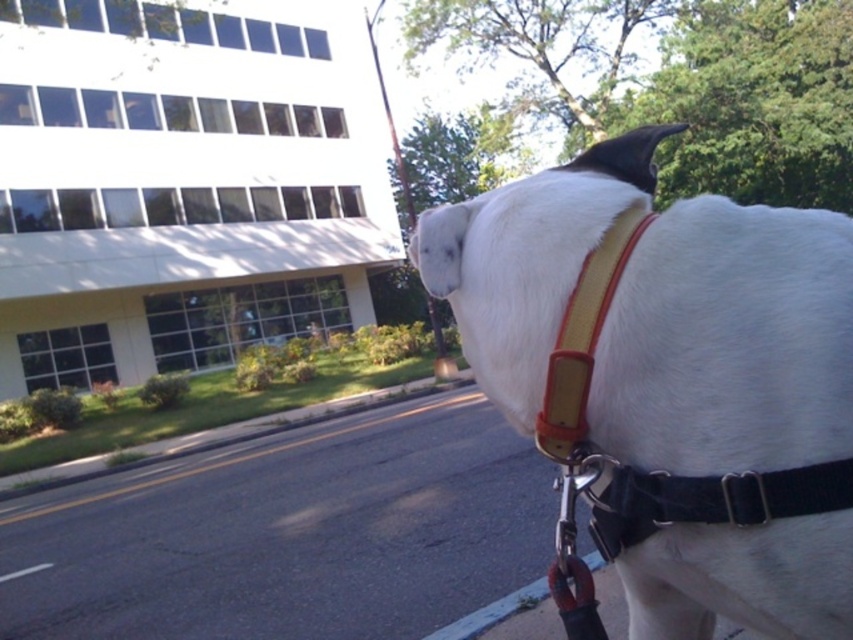
Does white matte dog at center have a lesser height compared to black leather strap at right?

No.

Can you confirm if white matte dog at center is thinner than black leather strap at right?

In fact, white matte dog at center might be wider than black leather strap at right.

Who is more distant from viewer, (466, 232) or (648, 509)?

Positioned behind is point (466, 232).

This screenshot has width=853, height=640. In order to click on white matte dog at center in this screenshot , I will do `click(671, 380)`.

Is white matte dog at center shorter than yellow leather strap at upper center?

In fact, white matte dog at center may be taller than yellow leather strap at upper center.

Is point (601, 289) farther from viewer compared to point (578, 278)?

No, (601, 289) is in front of (578, 278).

The height and width of the screenshot is (640, 853). Find the location of `white matte dog at center`. white matte dog at center is located at coordinates (671, 380).

Where is `black leather strap at right`? The width and height of the screenshot is (853, 640). black leather strap at right is located at coordinates (711, 499).

The image size is (853, 640). What do you see at coordinates (711, 499) in the screenshot? I see `black leather strap at right` at bounding box center [711, 499].

Locate an element on the screen. The image size is (853, 640). black leather strap at right is located at coordinates (711, 499).